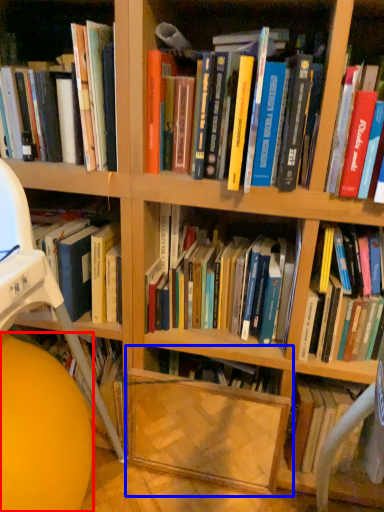
Question: Among these objects, which one is farthest to the camera, ball (highlighted by a red box) or shelf (highlighted by a blue box)?

Choices:
 (A) ball
 (B) shelf

Answer: (B)